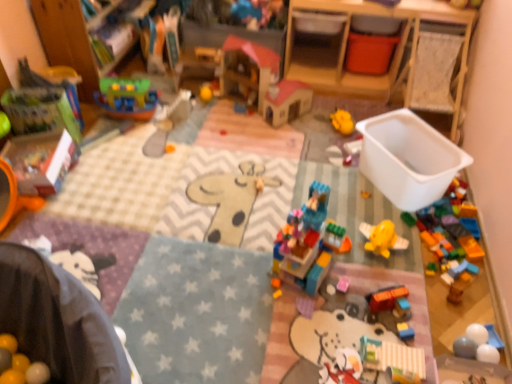
You are a GUI agent. You are given a task and a screenshot of the screen. Output one action in this format:
    pyautogui.click(x=<x>, y=<y>)
    Task: Click on the free space that is to the left of orange matte car at center, the 2th toy from the bottom
    This screenshot has width=512, height=384.
    Given the screenshot: What is the action you would take?
    pyautogui.click(x=342, y=301)